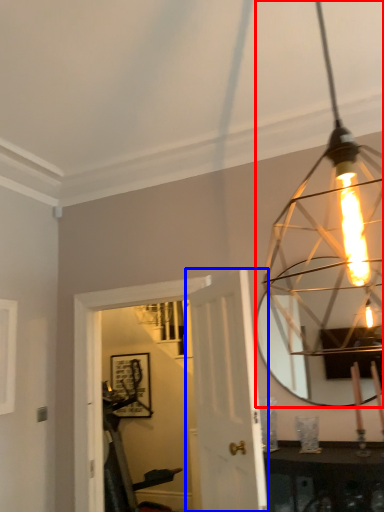
Question: Which object appears farthest to the camera in this image, lamp (highlighted by a red box) or door (highlighted by a blue box)?

Choices:
 (A) lamp
 (B) door

Answer: (B)